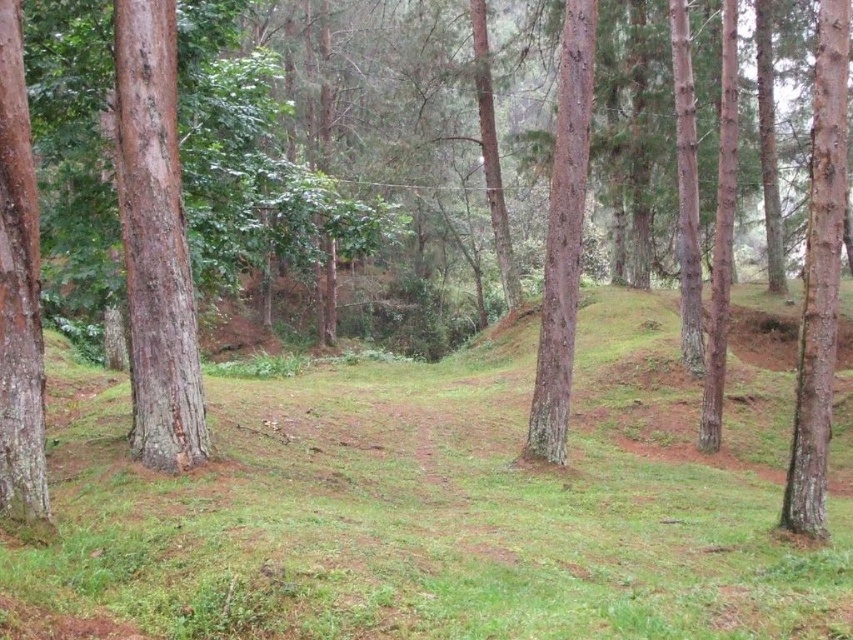
You are a hiker trying to determine which tree has a wider trunk between the smooth bark tree at right and the smooth brown tree trunk at left. Based on the scene, which one is wider?

The smooth bark tree at right has a wider trunk than the smooth brown tree trunk at left according to the description.

You are a hiker standing in the forest and see the smooth brown tree trunk at left and the smooth brown tree trunk at center. Which tree trunk is closer to the ground?

The smooth brown tree trunk at left is closer to the ground because it is positioned below the smooth brown tree trunk at center.